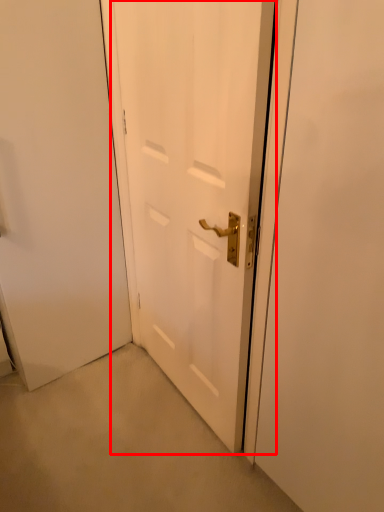
Question: Where is door (annotated by the red box) located in relation to screen door in the image?

Choices:
 (A) right
 (B) left

Answer: (B)